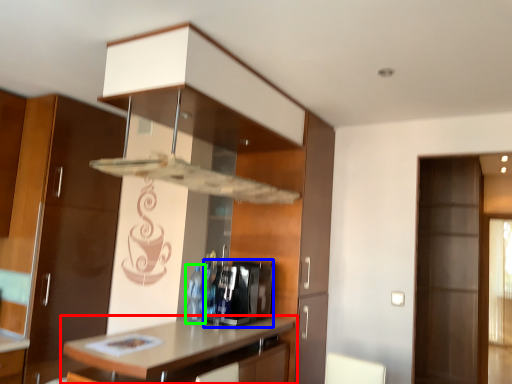
Question: Which object is positioned closest to countertop (highlighted by a red box)? Select from appliance (highlighted by a blue box) and bottle (highlighted by a green box).

Choices:
 (A) appliance
 (B) bottle

Answer: (A)